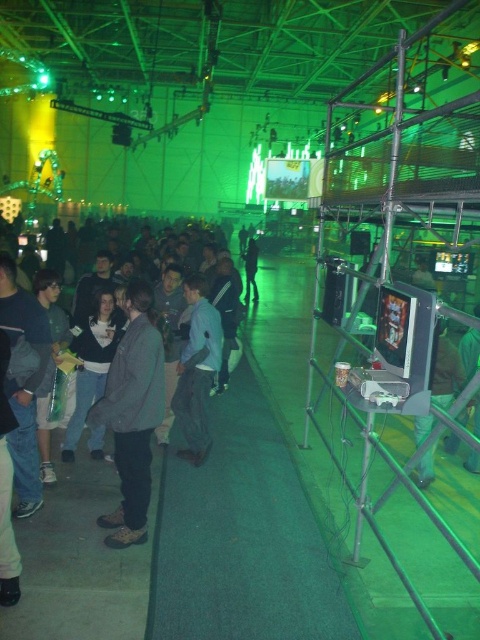
Question: Can you confirm if gray woolen jacket at center is positioned below green fabric pants at lower right?

Choices:
 (A) yes
 (B) no

Answer: (B)

Question: Observing the image, what is the correct spatial positioning of light blue denim jacket at center in reference to dark gray hoodie at center?

Choices:
 (A) below
 (B) above

Answer: (A)

Question: Which point is closer to the camera?

Choices:
 (A) (131, 340)
 (B) (200, 428)
 (C) (439, 365)
 (D) (243, 298)

Answer: (A)

Question: Is gray woolen jacket at center positioned at the back of light blue denim jacket at center?

Choices:
 (A) no
 (B) yes

Answer: (A)

Question: Which point is closer to the camera?

Choices:
 (A) dark gray hoodie at center
 (B) gray woolen jacket at center

Answer: (B)

Question: Which of these objects is positioned closest to the dark gray hoodie at center?

Choices:
 (A) green fabric pants at lower right
 (B) light blue denim jacket at center
 (C) gray woolen jacket at center

Answer: (B)